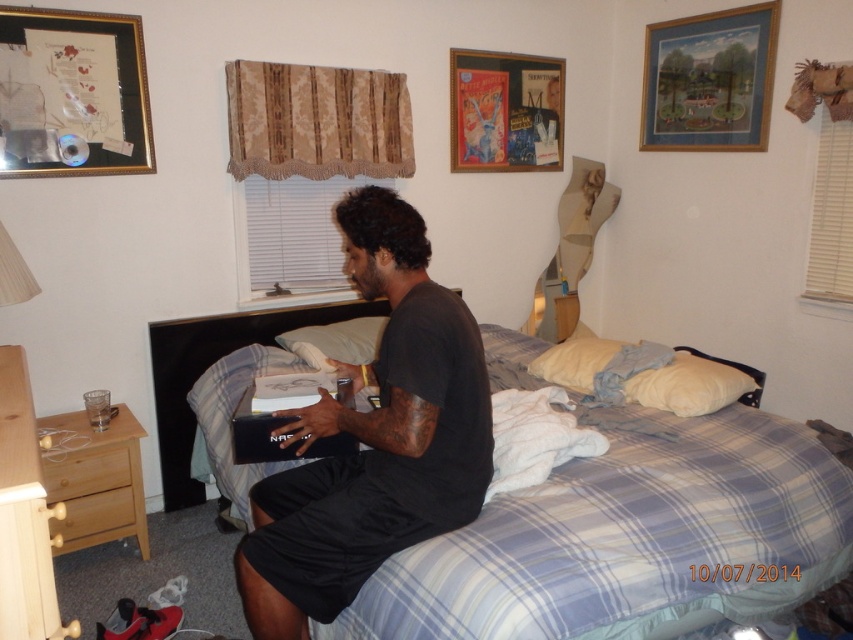
Question: Where is light brown wood dresser at lower left located in relation to white soft pillow at right in the image?

Choices:
 (A) below
 (B) above

Answer: (A)

Question: Which of the following is the farthest from the observer?

Choices:
 (A) (4, 524)
 (B) (306, 340)
 (C) (49, 109)

Answer: (B)

Question: Which of the following is the farthest from the observer?

Choices:
 (A) black matte shirt at center
 (B) blue plaid fabric bed at center
 (C) wooden framed painting at upper right
 (D) matte glass picture frame at upper left

Answer: (C)

Question: Is wooden picture frame at upper center thinner than beech wood dresser at lower left?

Choices:
 (A) yes
 (B) no

Answer: (B)

Question: Does matte glass picture frame at upper left have a greater width compared to beech wood dresser at lower left?

Choices:
 (A) yes
 (B) no

Answer: (B)

Question: Which object is positioned farthest from the beech wood dresser at lower left?

Choices:
 (A) light brown wood dresser at lower left
 (B) white soft pillow at right
 (C) blue plaid fabric bed at center
 (D) matte glass picture frame at upper left

Answer: (B)